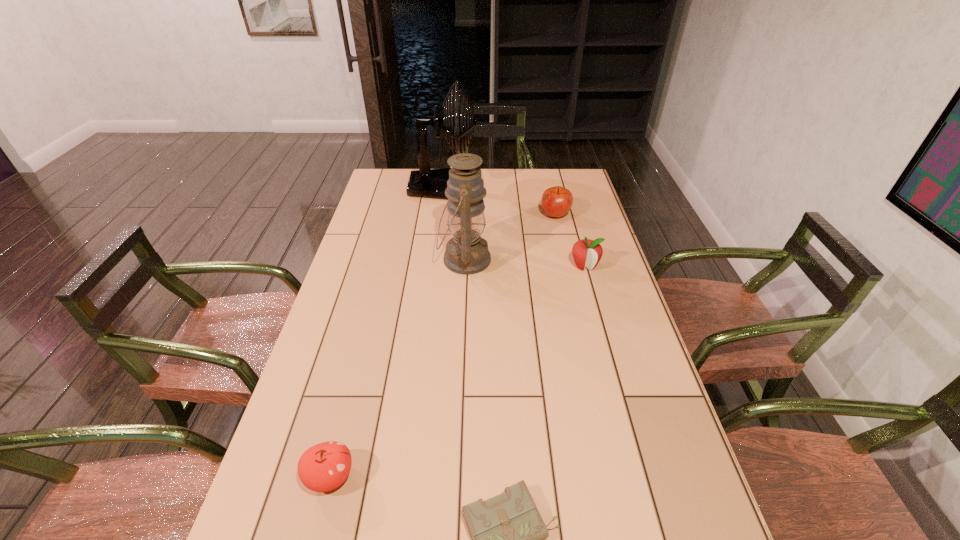
Find the location of a particular element. The image size is (960, 540). object present at the far edge is located at coordinates (429, 183).

At what (x,y) coordinates should I click in order to perform the action: click on fan that is at the left edge. Please return your answer as a coordinate pair (x, y). Looking at the image, I should click on (429, 183).

Where is `apple that is at the left edge`? The width and height of the screenshot is (960, 540). apple that is at the left edge is located at coordinates (323, 467).

You are a GUI agent. You are given a task and a screenshot of the screen. Output one action in this format:
    pyautogui.click(x=<x>, y=<y>)
    Task: Click on the object that is at the far left corner
    This screenshot has height=540, width=960.
    Given the screenshot: What is the action you would take?
    pyautogui.click(x=429, y=183)

Identify the location of vacant space at the far edge of the desktop. (514, 177).

Locate an element on the screen. The image size is (960, 540). vacant area at the left edge of the desktop is located at coordinates (366, 219).

In the image, there is a desktop. What are the coordinates of `vacant space at the right edge` in the screenshot? It's located at (635, 387).

You are a GUI agent. You are given a task and a screenshot of the screen. Output one action in this format:
    pyautogui.click(x=<x>, y=<y>)
    Task: Click on the free space at the far right corner of the desktop
    Image resolution: width=960 pixels, height=540 pixels.
    Given the screenshot: What is the action you would take?
    pyautogui.click(x=547, y=171)

The width and height of the screenshot is (960, 540). Find the location of `unoccupied area between the oil lamp and the leftmost apple`. unoccupied area between the oil lamp and the leftmost apple is located at coordinates (397, 368).

Where is `free space that is in between the oil lamp and the second nearest apple`? The height and width of the screenshot is (540, 960). free space that is in between the oil lamp and the second nearest apple is located at coordinates (524, 262).